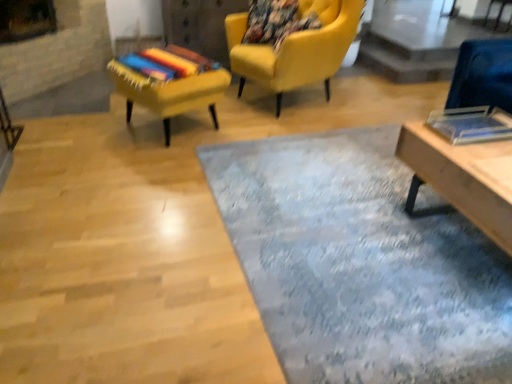
At what (x,y) coordinates should I click in order to perform the action: click on vacant area that lies between textured yellow chair at upper left, which appears as the 2th chair when viewed from the right, and textured blue rug at center. Please return your answer as a coordinate pair (x, y). This screenshot has height=384, width=512. Looking at the image, I should click on (206, 188).